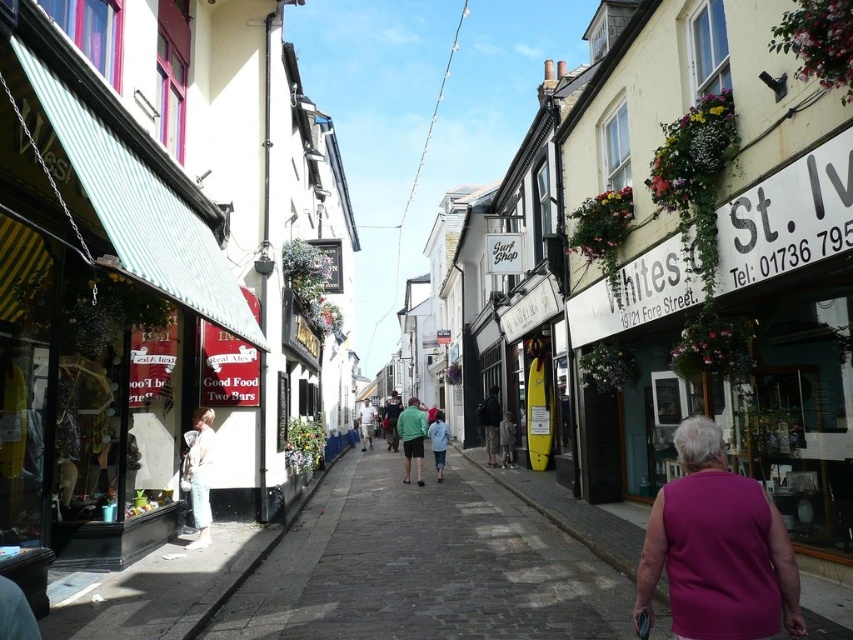
You are a customer in the West shop and want to try on both the purple sleeveless top at lower right and the light brown leather jacket at center. Which item would you need to step aside to try on due to its larger size?

The purple sleeveless top at lower right is wider than the light brown leather jacket at center, so you would need to step aside to try on the purple sleeveless top at lower right due to its larger width.

You are standing on the cobblestone street and see the green matte jacket at center. If you want to walk directly to it from your current position, which direction should you move in relation to the shops on the left side of the street?

Since the green matte jacket at center is located at coordinates approximately 0.684 along the horizontal axis and 0.484 vertically, you should move towards the center of the street from your current position, which is near the shops on the left side. This means moving towards the right relative to the shops on the left side of the street.

From the picture: You are a customer in the shop and want to try on the green matte jacket at center and the light blue denim shorts at center. Which item is positioned higher on the display rack?

The green matte jacket at center is above the light blue denim shorts at center, so the green matte jacket at center is positioned higher on the display rack.